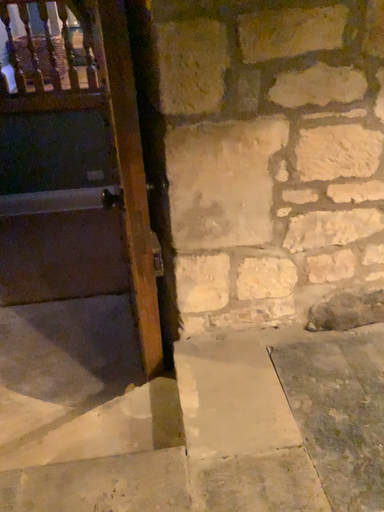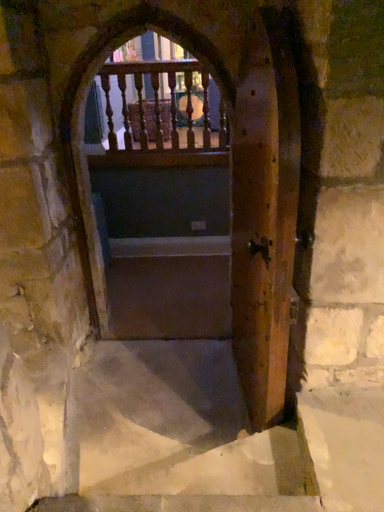
Question: How did the camera likely rotate when shooting the video?

Choices:
 (A) rotated right
 (B) rotated left

Answer: (B)